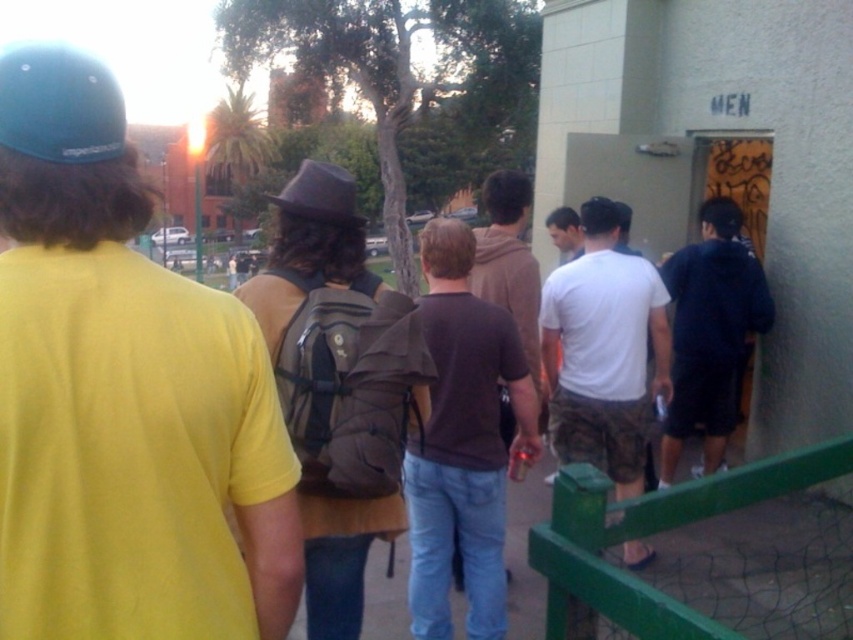
You are standing at the position of the viewer and want to hand a note to the person wearing the dark blue hoodie at center. If your throwing range is up to 5 meters, can you reach them?

The dark blue hoodie at center and viewer are 4.94 meters apart from each other, so yes, you can reach them with your throwing range of up to 5 meters.

Consider the image. You are a photographer trying to capture the group walking towards the building entrance. Since the brown matte shirt at center and the brown felt hat at center are both brown, how can you tell them apart in your photo?

The brown matte shirt at center is positioned under the brown felt hat at center, so the hat is above the shirt in the image.